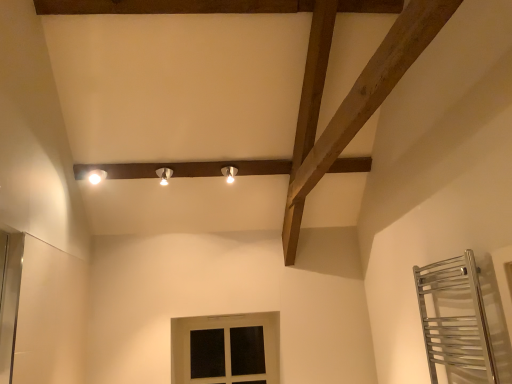
Question: In terms of width, does matte black window at lower center look wider or thinner when compared to matte silver light fixture at center, which is counted as the second light fixture, starting from the right?

Choices:
 (A) thin
 (B) wide

Answer: (A)

Question: In the image, is matte black window at lower center on the left side or the right side of matte silver light fixture at center, which is counted as the second light fixture, starting from the right?

Choices:
 (A) left
 (B) right

Answer: (B)

Question: Estimate the real-world distances between objects in this image. Which object is closer to the white glossy light fixture at upper left, the first light fixture when ordered from left to right?

Choices:
 (A) matte black window at lower center
 (B) white glossy light fixture at upper center, placed as the 1th light fixture when sorted from right to left
 (C) matte silver light fixture at center, the second light fixture positioned from the left

Answer: (C)

Question: Based on their relative distances, which object is farther from the white glossy light fixture at upper left, the first light fixture when ordered from left to right?

Choices:
 (A) white glossy light fixture at upper center, placed as the 1th light fixture when sorted from right to left
 (B) matte silver light fixture at center, which is counted as the second light fixture, starting from the right
 (C) matte black window at lower center

Answer: (C)